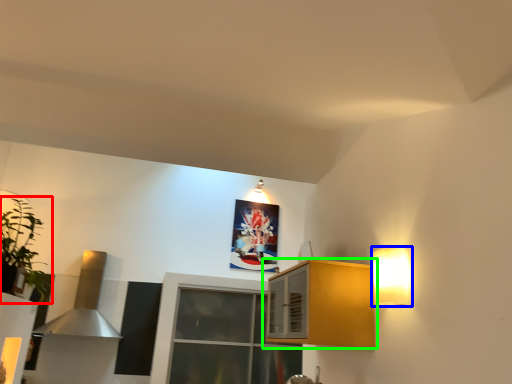
Question: Which is nearer to the houseplant (highlighted by a red box)? light fixture (highlighted by a blue box) or cabinetry (highlighted by a green box).

Choices:
 (A) light fixture
 (B) cabinetry

Answer: (B)